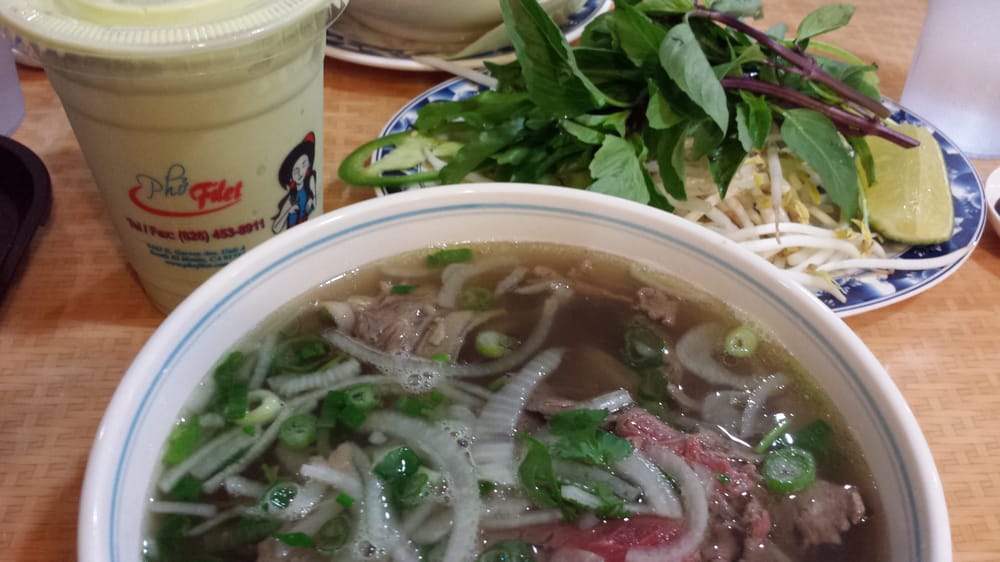
Locate an element on the screen. The width and height of the screenshot is (1000, 562). bowl is located at coordinates (620, 237).